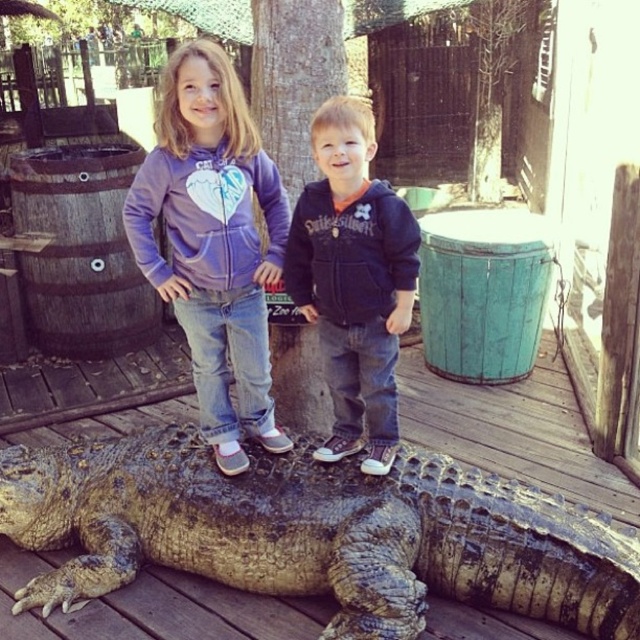
Question: Does leathery brown crocodile at center have a larger size compared to purple fleece hoodie at center?

Choices:
 (A) yes
 (B) no

Answer: (A)

Question: Considering the real-world distances, which object is closest to the purple fleece hoodie at center?

Choices:
 (A) dark blue hoodie at center
 (B) leathery brown crocodile at center

Answer: (A)

Question: Can you confirm if purple fleece hoodie at center is wider than dark blue hoodie at center?

Choices:
 (A) no
 (B) yes

Answer: (B)

Question: Can you confirm if leathery brown crocodile at center is positioned below purple fleece hoodie at center?

Choices:
 (A) yes
 (B) no

Answer: (A)

Question: Which object appears closest to the camera in this image?

Choices:
 (A) purple fleece hoodie at center
 (B) leathery brown crocodile at center
 (C) dark blue hoodie at center

Answer: (B)

Question: Which point appears farthest from the camera in this image?

Choices:
 (A) (156, 532)
 (B) (241, 284)
 (C) (330, 438)

Answer: (C)